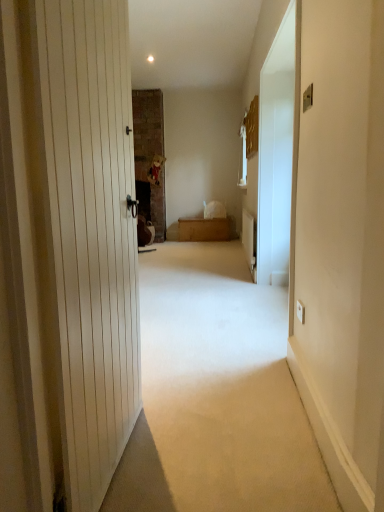
Question: Is white glossy screen door at right aimed at wooden chest at center?

Choices:
 (A) yes
 (B) no

Answer: (B)

Question: Could wooden chest at center be considered to be inside white glossy screen door at right?

Choices:
 (A) yes
 (B) no

Answer: (B)

Question: Is white glossy screen door at right taller than wooden chest at center?

Choices:
 (A) yes
 (B) no

Answer: (A)

Question: From the image's perspective, is white glossy screen door at right located beneath wooden chest at center?

Choices:
 (A) no
 (B) yes

Answer: (A)

Question: Considering the relative sizes of white glossy screen door at right and wooden chest at center in the image provided, is white glossy screen door at right wider than wooden chest at center?

Choices:
 (A) yes
 (B) no

Answer: (B)

Question: Considering the relative positions of white glossy screen door at right and beige carpet at center in the image provided, is white glossy screen door at right to the left or to the right of beige carpet at center?

Choices:
 (A) right
 (B) left

Answer: (A)

Question: Relative to beige carpet at center, is white glossy screen door at right in front or behind?

Choices:
 (A) behind
 (B) front

Answer: (A)

Question: Is white glossy screen door at right wider or thinner than beige carpet at center?

Choices:
 (A) wide
 (B) thin

Answer: (B)

Question: Considering the positions of white glossy screen door at right and beige carpet at center in the image, is white glossy screen door at right bigger or smaller than beige carpet at center?

Choices:
 (A) small
 (B) big

Answer: (A)

Question: Looking at the image, does wooden chest at center seem bigger or smaller compared to beige carpet at center?

Choices:
 (A) big
 (B) small

Answer: (B)

Question: Considering the positions of wooden chest at center and beige carpet at center in the image, is wooden chest at center wider or thinner than beige carpet at center?

Choices:
 (A) wide
 (B) thin

Answer: (B)

Question: Is wooden chest at center taller or shorter than beige carpet at center?

Choices:
 (A) tall
 (B) short

Answer: (A)

Question: From the image's perspective, is wooden chest at center above or below beige carpet at center?

Choices:
 (A) above
 (B) below

Answer: (A)

Question: Considering the positions of point (210, 239) and point (281, 187), is point (210, 239) closer or farther from the camera than point (281, 187)?

Choices:
 (A) closer
 (B) farther

Answer: (B)

Question: Visually, is wooden chest at center positioned to the left or to the right of white glossy screen door at right?

Choices:
 (A) left
 (B) right

Answer: (A)